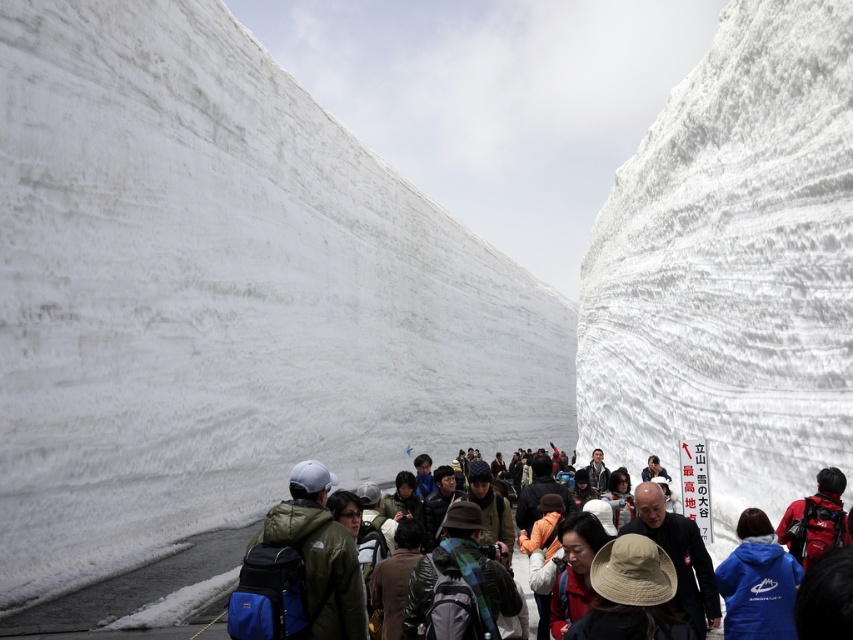
You are a photographer in the snow passage. You want to take a photo of the beige straw hat at center and the white fluffy snow at center. Which object should you focus on first if you want to capture both in the same frame without moving the camera?

The white fluffy snow at center is positioned on the left side of beige straw hat at center, so you should focus on the white fluffy snow at center first to ensure both objects are in the frame.

You are a photographer planning to take a photo of the group of people in the snow passage. You want to ensure the white fluffy snow at center and the blue fleece jacket at center are both visible in the frame. Which object should be placed to the left side in your composition?

The white fluffy snow at center should be placed to the left side in your composition because it is positioned on the left side of the blue fleece jacket at center according to the description.

You are a photographer trying to capture a clear shot of the blue fleece jacket at center and the red fabric hat at center in the snow passage. Which object should you focus on first to ensure it appears larger in your photo?

You should focus on the blue fleece jacket at center first because it is larger in size than the red fabric hat at center, making it more prominent in the frame.